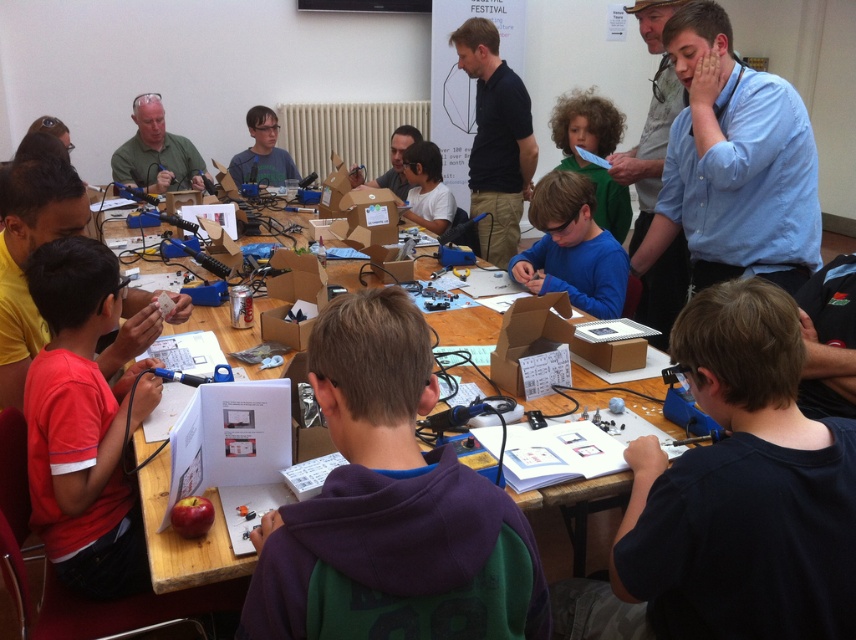
You are standing at the front of the classroom looking at the table with the electronic components. There are two points marked on the table. Which point, point (x=542, y=406) or point (x=423, y=216), is closer to you?

Point (x=542, y=406) is closer to the viewer than point (x=423, y=216).